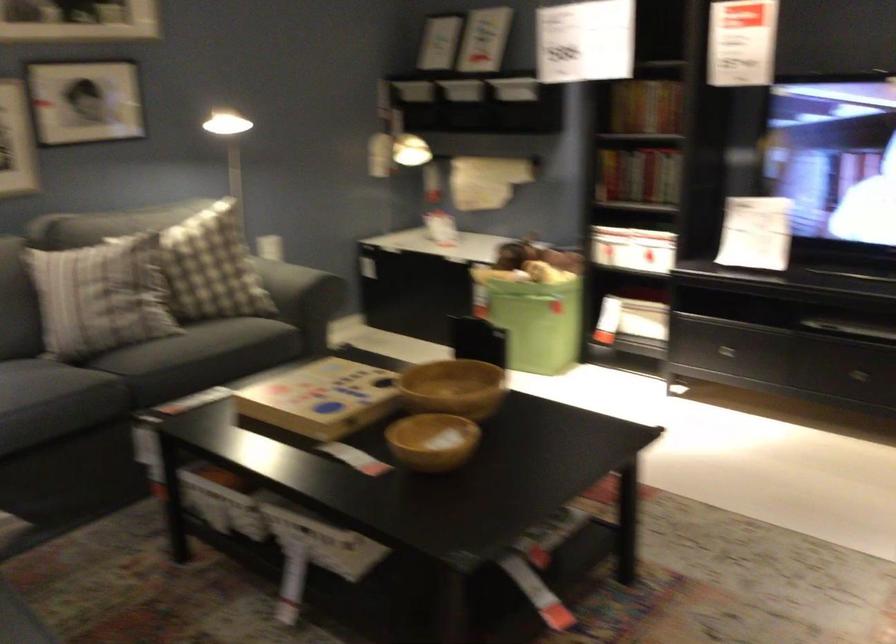
What do you see at coordinates (286, 285) in the screenshot? I see `the sofa armrest` at bounding box center [286, 285].